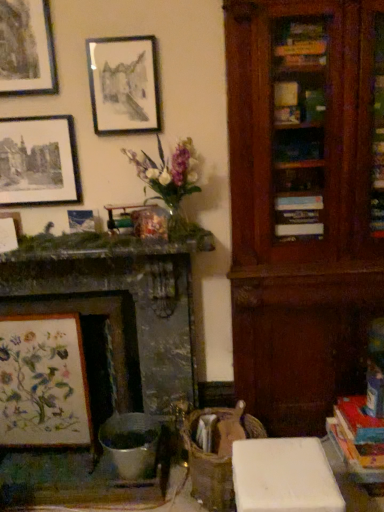
Question: Can you confirm if matte black picture frame at upper center, which ranks as the second picture frame in top-to-bottom order, is positioned to the left of matte black picture frame at upper left, the 4th picture frame in the bottom-to-top sequence?

Choices:
 (A) yes
 (B) no

Answer: (B)

Question: Can you confirm if matte black picture frame at upper center, which ranks as the second picture frame in top-to-bottom order, is taller than matte black picture frame at upper left, the 4th picture frame in the bottom-to-top sequence?

Choices:
 (A) yes
 (B) no

Answer: (A)

Question: From the image's perspective, is matte black picture frame at upper center, which ranks as the second picture frame in top-to-bottom order, under matte black picture frame at upper left, the 4th picture frame in the bottom-to-top sequence?

Choices:
 (A) no
 (B) yes

Answer: (A)

Question: Considering the relative sizes of matte black picture frame at upper center, which is the fifth picture frame in bottom-to-top order, and matte black picture frame at upper left, the third picture frame viewed from the top, in the image provided, is matte black picture frame at upper center, which is the fifth picture frame in bottom-to-top order, thinner than matte black picture frame at upper left, the third picture frame viewed from the top,?

Choices:
 (A) no
 (B) yes

Answer: (A)

Question: Considering the relative sizes of matte black picture frame at upper center, which is the fifth picture frame in bottom-to-top order, and matte black picture frame at upper left, the 4th picture frame in the bottom-to-top sequence, in the image provided, is matte black picture frame at upper center, which is the fifth picture frame in bottom-to-top order, bigger than matte black picture frame at upper left, the 4th picture frame in the bottom-to-top sequence,?

Choices:
 (A) no
 (B) yes

Answer: (A)

Question: Is point (21, 139) closer or farther from the camera than point (91, 219)?

Choices:
 (A) farther
 (B) closer

Answer: (B)

Question: From the image's perspective, relative to metallic silver picture frame at upper left, the third picture frame ordered from the bottom, is matte black picture frame at upper left, the third picture frame viewed from the top, above or below?

Choices:
 (A) above
 (B) below

Answer: (A)

Question: Based on their positions, is matte black picture frame at upper left, the 4th picture frame in the bottom-to-top sequence, located to the left or right of metallic silver picture frame at upper left, the fourth picture frame viewed from the top?

Choices:
 (A) left
 (B) right

Answer: (A)

Question: In terms of width, does matte black picture frame at upper left, the third picture frame viewed from the top, look wider or thinner when compared to metallic silver picture frame at upper left, the third picture frame ordered from the bottom?

Choices:
 (A) thin
 (B) wide

Answer: (A)

Question: From a real-world perspective, relative to matte black picture frame at upper center, which ranks as the second picture frame in top-to-bottom order, is hardcover book at lower right vertically above or below?

Choices:
 (A) above
 (B) below

Answer: (B)

Question: From the image's perspective, is hardcover book at lower right located above or below matte black picture frame at upper center, which is the fifth picture frame in bottom-to-top order?

Choices:
 (A) above
 (B) below

Answer: (B)

Question: In terms of height, does hardcover book at lower right look taller or shorter compared to matte black picture frame at upper center, which is the fifth picture frame in bottom-to-top order?

Choices:
 (A) tall
 (B) short

Answer: (B)

Question: Looking at their shapes, would you say hardcover book at lower right is wider or thinner than matte black picture frame at upper center, which ranks as the second picture frame in top-to-bottom order?

Choices:
 (A) wide
 (B) thin

Answer: (A)

Question: In the image, is wooden swivel chair at center positioned in front of or behind marble fireplace at left?

Choices:
 (A) front
 (B) behind

Answer: (B)

Question: From a real-world perspective, is wooden swivel chair at center above or below marble fireplace at left?

Choices:
 (A) above
 (B) below

Answer: (B)